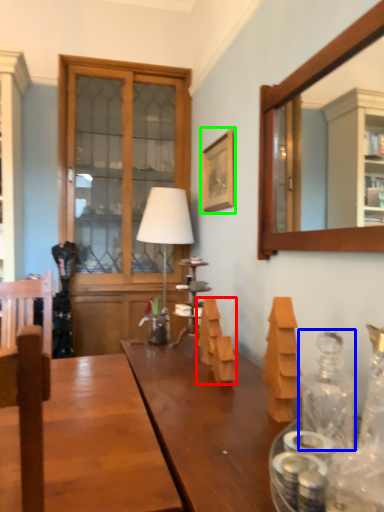
Question: Which object is positioned closest to wood (highlighted by a red box)? Select from glass jar (highlighted by a blue box) and picture frame (highlighted by a green box).

Choices:
 (A) glass jar
 (B) picture frame

Answer: (A)